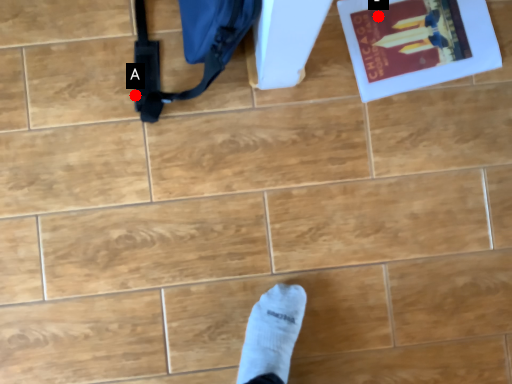
Question: Two points are circled on the image, labeled by A and B beside each circle. Which point is farther to the camera?

Choices:
 (A) A is further
 (B) B is further

Answer: (B)